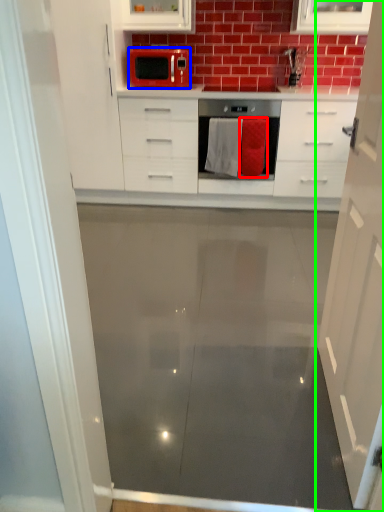
Question: Which object is the farthest from material (highlighted by a red box)? Choose among these: microwave oven (highlighted by a blue box) or cabinetry (highlighted by a green box).

Choices:
 (A) microwave oven
 (B) cabinetry

Answer: (B)